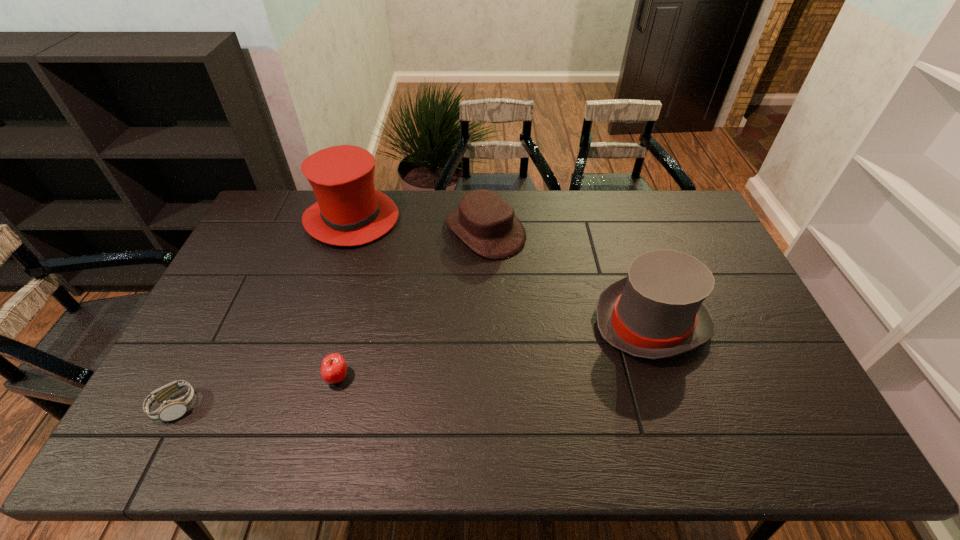
This screenshot has height=540, width=960. Find the location of `free space between the leftmost object and the rightmost hat`. free space between the leftmost object and the rightmost hat is located at coordinates (413, 364).

Image resolution: width=960 pixels, height=540 pixels. In order to click on empty space between the second shortest object and the fourth object from left to right in this screenshot , I will do `click(411, 304)`.

Where is `vacant space that is in between the third shortest object and the apple`? The width and height of the screenshot is (960, 540). vacant space that is in between the third shortest object and the apple is located at coordinates (411, 304).

You are a GUI agent. You are given a task and a screenshot of the screen. Output one action in this format:
    pyautogui.click(x=<x>, y=<y>)
    Task: Click on the object that is the third closest to the tallest object
    
    Given the screenshot: What is the action you would take?
    pyautogui.click(x=170, y=410)

You are a GUI agent. You are given a task and a screenshot of the screen. Output one action in this format:
    pyautogui.click(x=<x>, y=<y>)
    Task: Click on the object that is the closest to the rightmost object
    The width and height of the screenshot is (960, 540).
    Given the screenshot: What is the action you would take?
    pyautogui.click(x=485, y=222)

Image resolution: width=960 pixels, height=540 pixels. In order to click on the second closest hat to the watch in this screenshot , I will do tap(485, 222).

Where is `hat that stands as the second closest to the shortest hat`? hat that stands as the second closest to the shortest hat is located at coordinates (657, 311).

Identify the location of vacant space that satisfies the following two spatial constraints: 1. on the front side of the tallest hat; 2. on the face of the watch. Image resolution: width=960 pixels, height=540 pixels. (292, 407).

The image size is (960, 540). Identify the location of vacant space that satisfies the following two spatial constraints: 1. on the front side of the fourth shortest object; 2. on the left side of the shortest hat. (487, 322).

The width and height of the screenshot is (960, 540). What are the coordinates of `free space that satisfies the following two spatial constraints: 1. on the front side of the tallest object; 2. on the left side of the fourth object from left to right` in the screenshot? It's located at (348, 231).